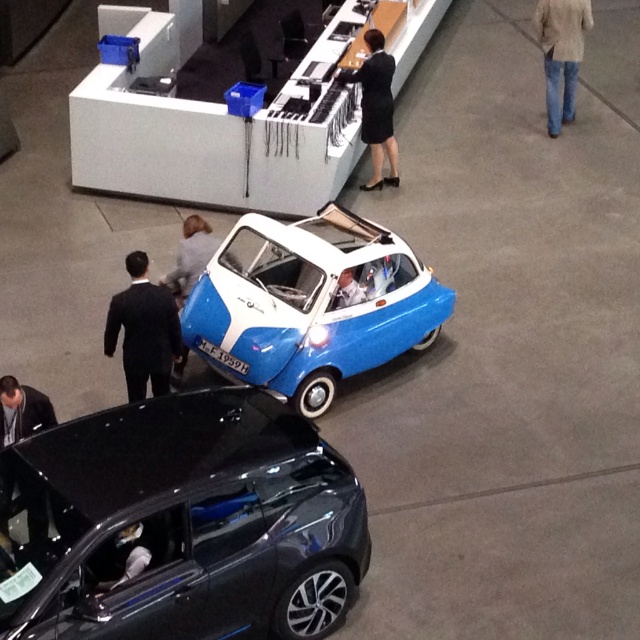
Question: Which is nearer to the black fabric skirt at center?

Choices:
 (A) black leather jacket at lower left
 (B) jeans at center
 (C) light gray fabric jacket at center

Answer: (B)

Question: From the image, what is the correct spatial relationship of shiny black car at lower left in relation to black suit at left?

Choices:
 (A) above
 (B) below

Answer: (B)

Question: Estimate the real-world distances between objects in this image. Which object is farther from the shiny black car at lower left?

Choices:
 (A) black leather jacket at lower left
 (B) white fabric person at center
 (C) black suit at left

Answer: (B)

Question: Is jeans at center to the left of black fabric skirt at center from the viewer's perspective?

Choices:
 (A) no
 (B) yes

Answer: (A)

Question: Among these points, which one is farthest from the camera?

Choices:
 (A) (364, 296)
 (B) (349, 326)
 (C) (163, 291)

Answer: (A)

Question: Is black fabric skirt at center smaller than black leather jacket at lower left?

Choices:
 (A) yes
 (B) no

Answer: (B)